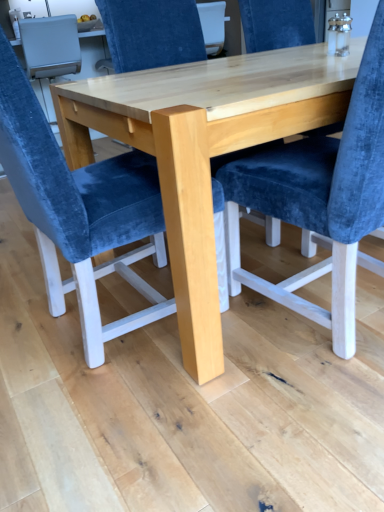
Question: Is velvet blue chair at center, the 2th chair viewed from the back, to the right of natural wood table at center from the viewer's perspective?

Choices:
 (A) yes
 (B) no

Answer: (B)

Question: Considering the relative sizes of velvet blue chair at center, the 2th chair viewed from the back, and natural wood table at center in the image provided, is velvet blue chair at center, the 2th chair viewed from the back, smaller than natural wood table at center?

Choices:
 (A) no
 (B) yes

Answer: (B)

Question: From the image's perspective, is velvet blue chair at center, placed as the first chair when sorted from front to back, above natural wood table at center?

Choices:
 (A) yes
 (B) no

Answer: (B)

Question: Does velvet blue chair at center, the 2th chair viewed from the back, appear on the left side of natural wood table at center?

Choices:
 (A) no
 (B) yes

Answer: (B)

Question: Considering the relative sizes of velvet blue chair at center, placed as the first chair when sorted from front to back, and natural wood table at center in the image provided, is velvet blue chair at center, placed as the first chair when sorted from front to back, shorter than natural wood table at center?

Choices:
 (A) yes
 (B) no

Answer: (B)

Question: From the image's perspective, is velvet blue chair at center, placed as the first chair when sorted from front to back, below natural wood table at center?

Choices:
 (A) no
 (B) yes

Answer: (B)

Question: Considering the relative sizes of velvet blue chair at center, the second chair viewed from the front, and velvet blue chair at center, the 2th chair viewed from the back, in the image provided, is velvet blue chair at center, the second chair viewed from the front, shorter than velvet blue chair at center, the 2th chair viewed from the back,?

Choices:
 (A) no
 (B) yes

Answer: (A)

Question: Is velvet blue chair at center, the 1th chair in the back-to-front sequence, next to velvet blue chair at center, the 2th chair viewed from the back?

Choices:
 (A) yes
 (B) no

Answer: (B)

Question: From a real-world perspective, is velvet blue chair at center, the second chair viewed from the front, physically below velvet blue chair at center, placed as the first chair when sorted from front to back?

Choices:
 (A) no
 (B) yes

Answer: (A)

Question: From the image's perspective, does velvet blue chair at center, the 1th chair in the back-to-front sequence, appear higher than velvet blue chair at center, placed as the first chair when sorted from front to back?

Choices:
 (A) yes
 (B) no

Answer: (A)

Question: Is velvet blue chair at center, the 2th chair viewed from the back, at the back of velvet blue chair at center, the second chair viewed from the front?

Choices:
 (A) yes
 (B) no

Answer: (B)

Question: Does velvet blue chair at center, the 1th chair in the back-to-front sequence, appear on the left side of velvet blue chair at center, the 2th chair viewed from the back?

Choices:
 (A) no
 (B) yes

Answer: (A)

Question: Can you confirm if velvet blue chair at center, placed as the first chair when sorted from front to back, is smaller than velvet blue chair at center, the second chair viewed from the front?

Choices:
 (A) no
 (B) yes

Answer: (B)